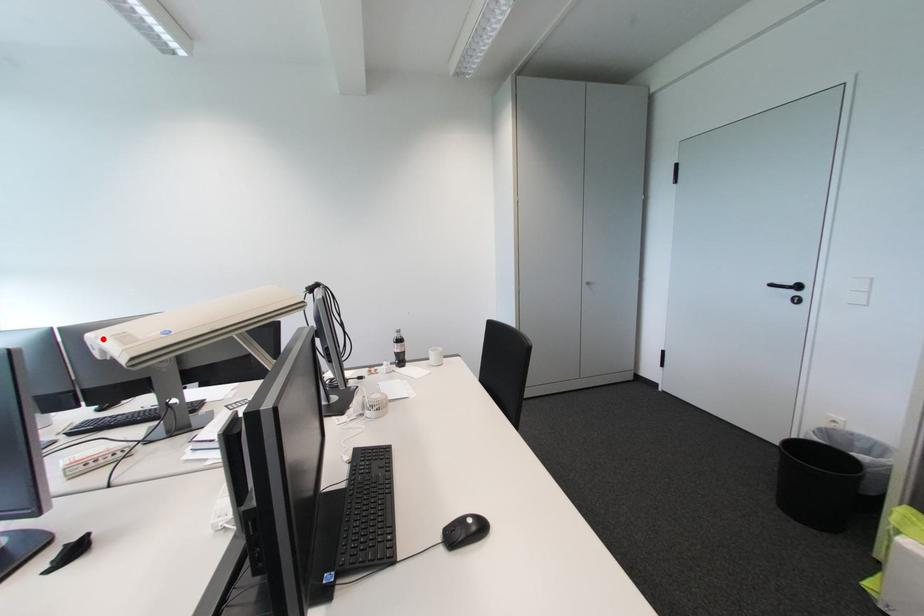
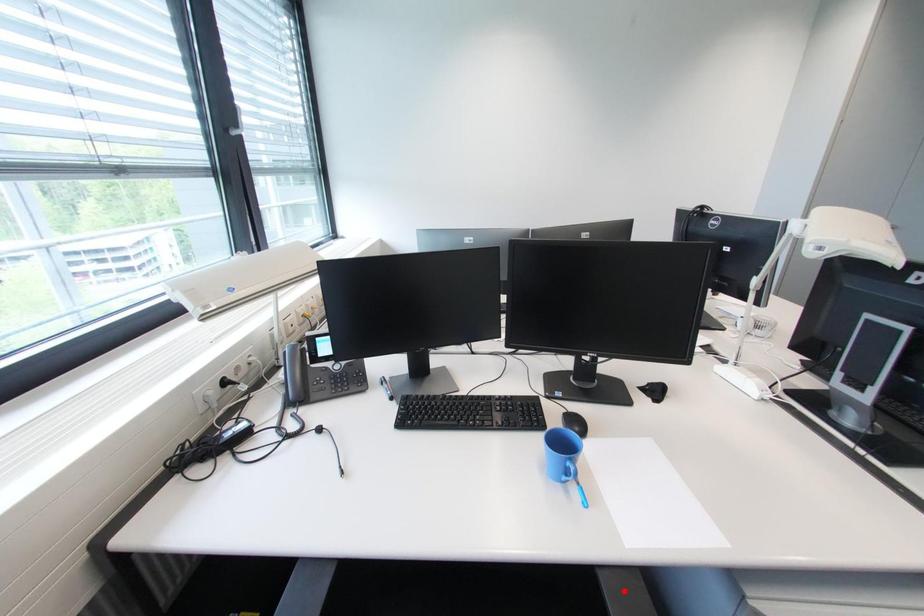
I am providing you with two images of the same scene from different viewpoints. A red point is marked on the first image and another point is marked on the second image. Does the point marked in image1 correspond to the same location as the one in image2?

No